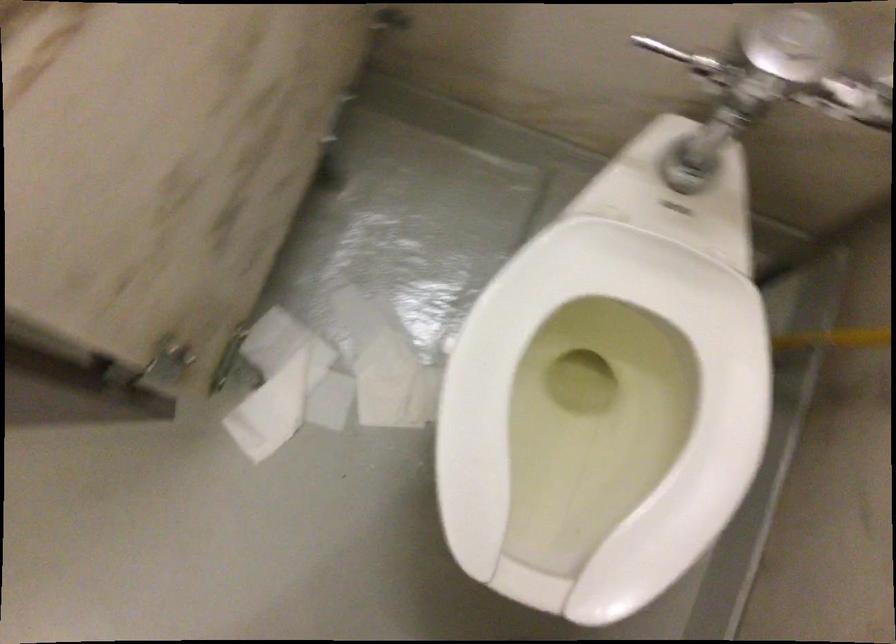
Where would you slid the stall door latch? Please return your answer as a coordinate pair (x, y).

(185, 393)